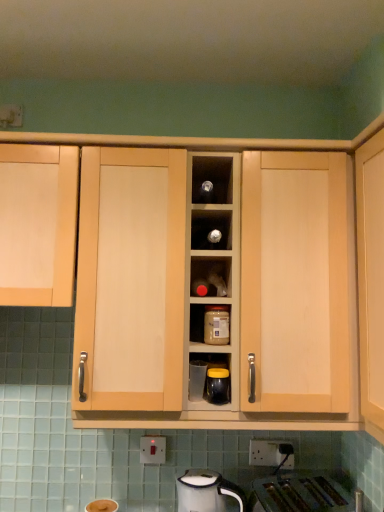
Question: Is clear glass jar at center, positioned as the first appliance in left-to-right order, oriented towards white plastic electric outlet at lower center?

Choices:
 (A) no
 (B) yes

Answer: (A)

Question: Can you confirm if clear glass jar at center, which is the first appliance from back to front, is shorter than white plastic electric outlet at lower center?

Choices:
 (A) no
 (B) yes

Answer: (A)

Question: Would you say white plastic electric outlet at lower center is part of clear glass jar at center, positioned as the first appliance in left-to-right order,'s contents?

Choices:
 (A) no
 (B) yes

Answer: (A)

Question: Are clear glass jar at center, the 2th appliance from the front, and white plastic electric outlet at lower center far apart?

Choices:
 (A) no
 (B) yes

Answer: (A)

Question: From a real-world perspective, is clear glass jar at center, which is the first appliance from back to front, beneath white plastic electric outlet at lower center?

Choices:
 (A) yes
 (B) no

Answer: (B)

Question: Visually, is matte black jar at center, which ranks as the first appliance in right-to-left order, positioned to the left or to the right of matte plastic jar at center?

Choices:
 (A) left
 (B) right

Answer: (B)

Question: In terms of width, does matte black jar at center, which ranks as the second appliance in back-to-front order, look wider or thinner when compared to matte plastic jar at center?

Choices:
 (A) wide
 (B) thin

Answer: (B)

Question: Is point (208, 377) closer or farther from the camera than point (215, 332)?

Choices:
 (A) farther
 (B) closer

Answer: (B)

Question: Considering the positions of matte black jar at center, the first appliance when ordered from front to back, and matte plastic jar at center in the image, is matte black jar at center, the first appliance when ordered from front to back, taller or shorter than matte plastic jar at center?

Choices:
 (A) tall
 (B) short

Answer: (B)

Question: In the image, is clear glass jar at center, which is the first appliance from back to front, on the left side or the right side of matte plastic jar at center?

Choices:
 (A) left
 (B) right

Answer: (A)

Question: Considering the positions of point (190, 382) and point (228, 342), is point (190, 382) closer or farther from the camera than point (228, 342)?

Choices:
 (A) farther
 (B) closer

Answer: (A)

Question: Is clear glass jar at center, positioned as the first appliance in left-to-right order, inside or outside of matte plastic jar at center?

Choices:
 (A) outside
 (B) inside

Answer: (A)

Question: In terms of height, does clear glass jar at center, the 2th appliance from the front, look taller or shorter compared to matte plastic jar at center?

Choices:
 (A) short
 (B) tall

Answer: (A)

Question: Based on their sizes in the image, would you say light wood cabinet at left, which ranks as the second cabinetry in right-to-left order, is bigger or smaller than white glossy electric kettle at lower center?

Choices:
 (A) small
 (B) big

Answer: (B)

Question: Is light wood cabinet at left, which ranks as the second cabinetry in right-to-left order, to the left or to the right of white glossy electric kettle at lower center in the image?

Choices:
 (A) left
 (B) right

Answer: (A)